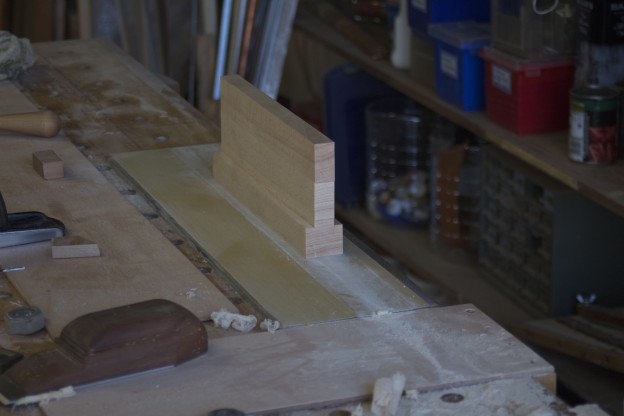
You are a GUI agent. You are given a task and a screenshot of the screen. Output one action in this format:
    pyautogui.click(x=<x>, y=<y>)
    Task: Click on the wooden worktable
    The height and width of the screenshot is (416, 624).
    Given the screenshot: What is the action you would take?
    pyautogui.click(x=127, y=100)